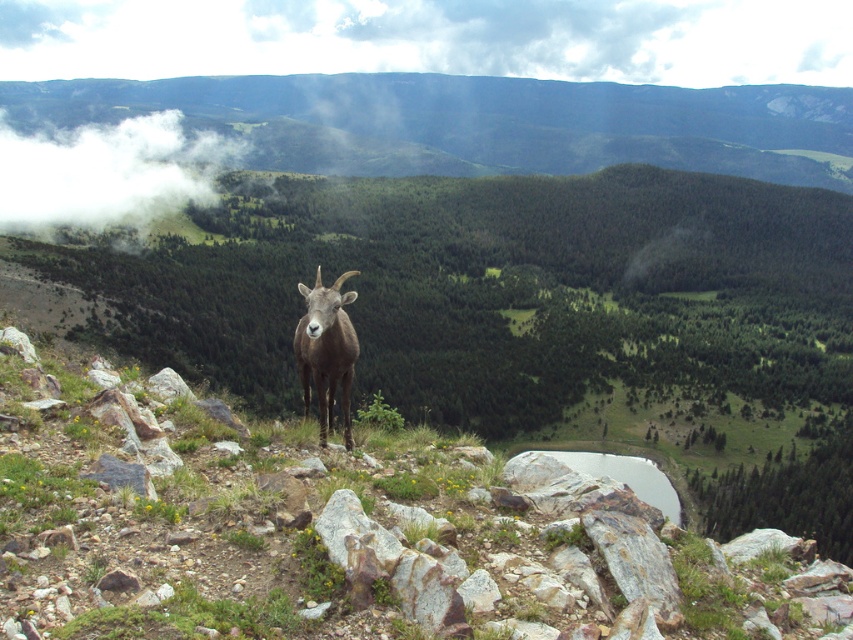
What are the coordinates of the white fluffy cloud at upper left?

The white fluffy cloud at upper left is located at coordinates point (106, 173).

You are a photographer aiming to capture the brown woolly goat at center and the white fluffy cloud at upper left in the same frame. Based on their positions, which object would appear closer to the left edge of your photo?

The white fluffy cloud at upper left is positioned to the left of the brown woolly goat at center, so it would appear closer to the left edge of the photo.